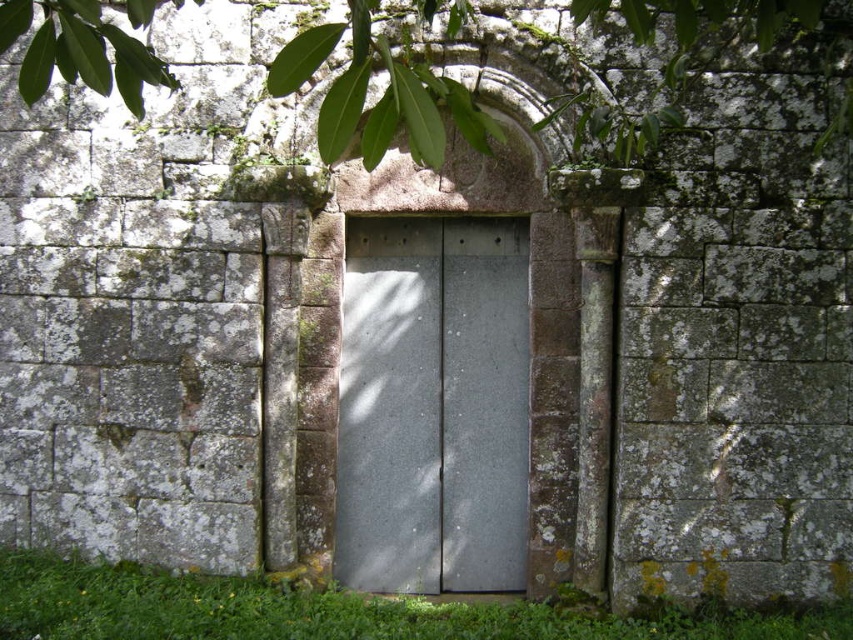
Question: Which of these objects is positioned closest to the green leafy tree at upper center?

Choices:
 (A) green grass at bottom
 (B) slate gray metal door at center

Answer: (B)

Question: Is slate gray metal door at center to the left of green leafy tree at upper center from the viewer's perspective?

Choices:
 (A) no
 (B) yes

Answer: (B)

Question: Can you confirm if slate gray metal door at center is wider than green grass at bottom?

Choices:
 (A) no
 (B) yes

Answer: (A)

Question: From the image, what is the correct spatial relationship of slate gray metal door at center in relation to green leafy tree at upper center?

Choices:
 (A) below
 (B) above

Answer: (A)

Question: Which object is farther from the camera taking this photo?

Choices:
 (A) slate gray metal door at center
 (B) green leafy tree at upper center

Answer: (A)

Question: Which object is positioned closest to the green leafy tree at upper center?

Choices:
 (A) slate gray metal door at center
 (B) green grass at bottom

Answer: (A)